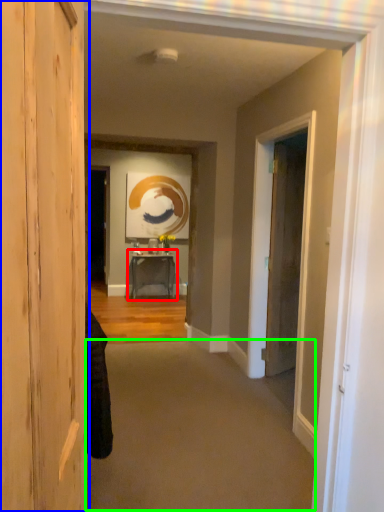
Question: Considering the real-world distances, which object is farthest from table (highlighted by a red box)? door (highlighted by a blue box) or plain (highlighted by a green box)?

Choices:
 (A) door
 (B) plain

Answer: (A)